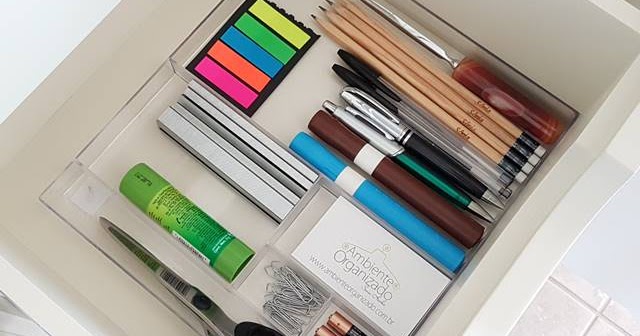
Identify the location of writing utensils. This screenshot has width=640, height=336. click(x=374, y=27), click(x=370, y=36), click(x=367, y=41), click(x=361, y=51), click(x=361, y=66), click(x=362, y=88), click(x=365, y=108), click(x=365, y=129), click(x=355, y=153), click(x=351, y=181).